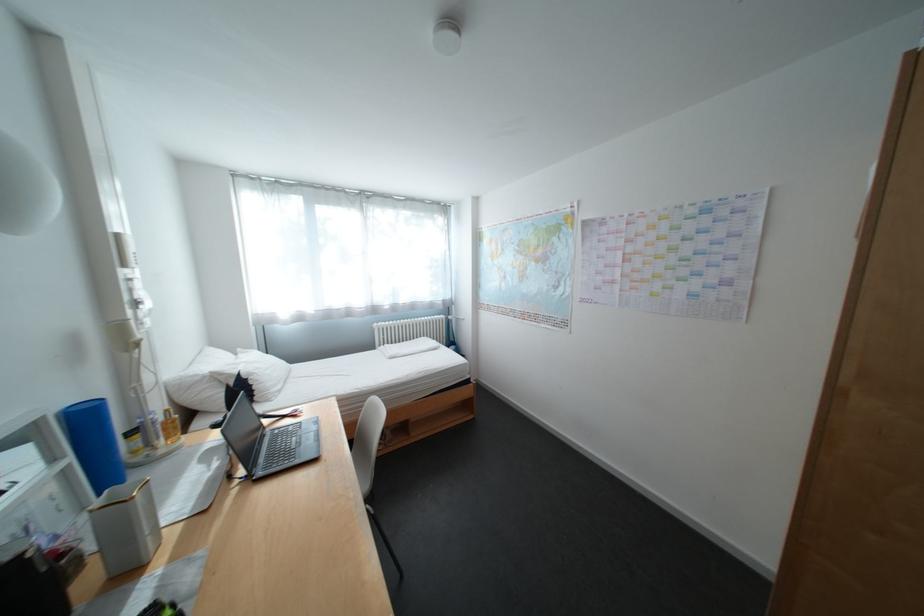
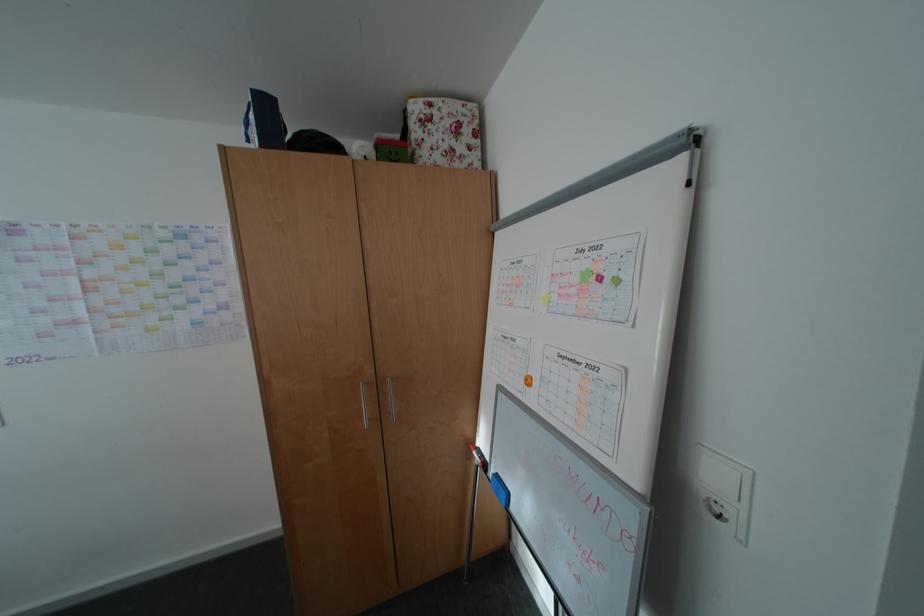
Question: The images are taken continuously from a first-person perspective. In which direction is your viewpoint rotating?

Choices:
 (A) Left
 (B) Right
 (C) Up
 (D) Down

Answer: (B)